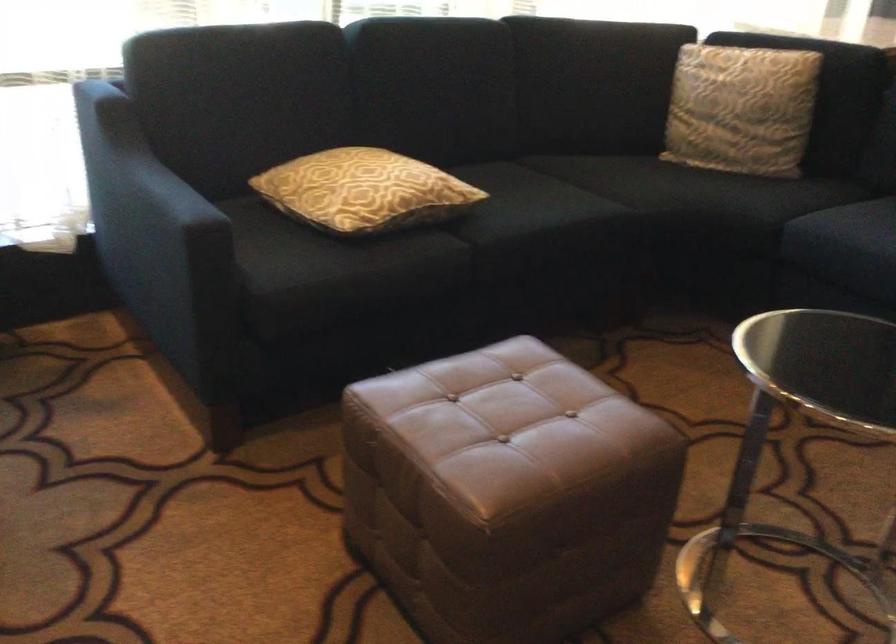
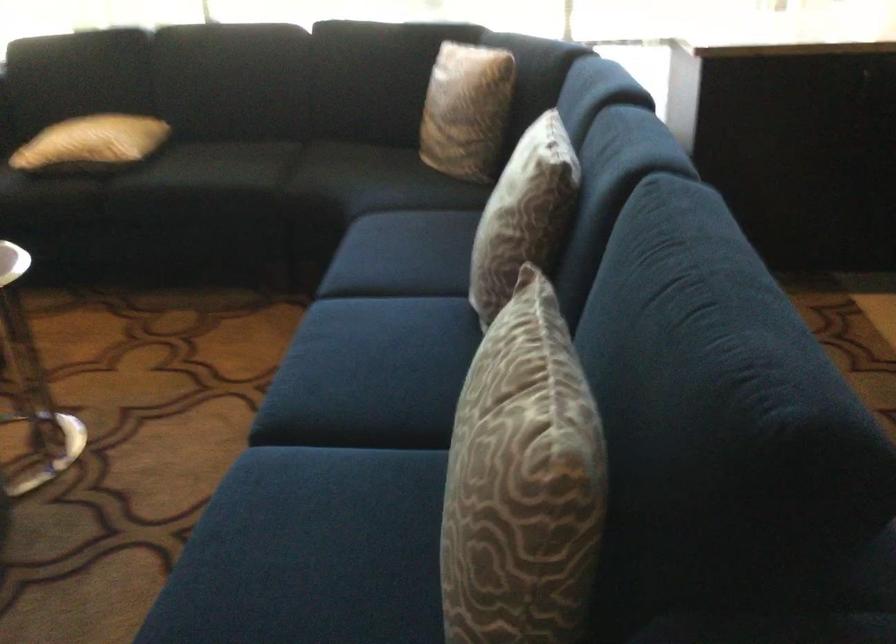
Where in the second image is the point corresponding to pixel 431 185 from the first image?

(91, 142)